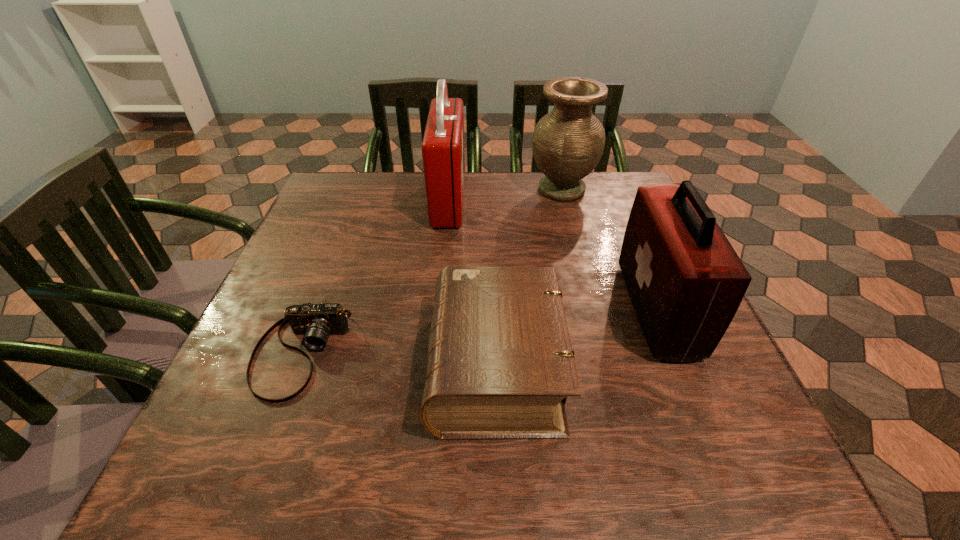
Identify the location of object that is at the left edge. The height and width of the screenshot is (540, 960). (316, 322).

Image resolution: width=960 pixels, height=540 pixels. I want to click on vase present at the right edge, so click(x=568, y=142).

This screenshot has height=540, width=960. I want to click on the first aid kit located in the right edge section of the desktop, so click(685, 280).

Where is `object at the far right corner`? The height and width of the screenshot is (540, 960). object at the far right corner is located at coordinates (568, 142).

In the image, there is a desktop. Identify the location of vacant space at the far edge. (409, 174).

In the image, there is a desktop. Where is `free space at the near edge`? Image resolution: width=960 pixels, height=540 pixels. free space at the near edge is located at coordinates [351, 487].

In the image, there is a desktop. Where is `vacant area at the right edge`? The height and width of the screenshot is (540, 960). vacant area at the right edge is located at coordinates (714, 400).

This screenshot has width=960, height=540. What are the coordinates of `vacant space at the far right corner` in the screenshot? It's located at (622, 201).

Where is `vacant space that is in between the vase and the left first aid kit`? This screenshot has height=540, width=960. vacant space that is in between the vase and the left first aid kit is located at coordinates (505, 195).

You are a GUI agent. You are given a task and a screenshot of the screen. Output one action in this format:
    pyautogui.click(x=<x>, y=<y>)
    Task: Click on the vacant area that lies between the taller first aid kit and the camera
    Image resolution: width=960 pixels, height=540 pixels.
    Given the screenshot: What is the action you would take?
    pyautogui.click(x=374, y=276)